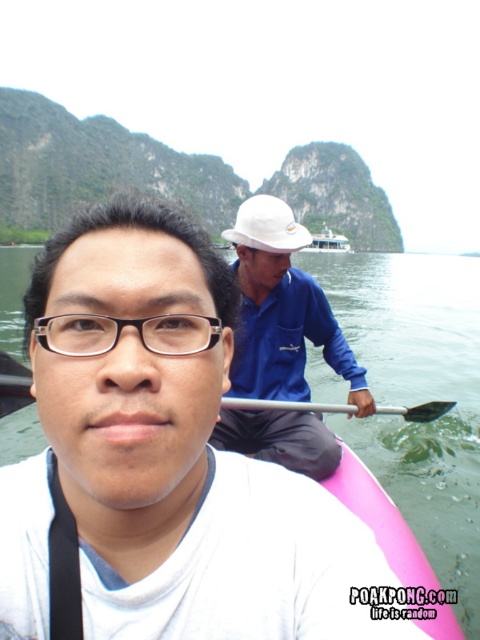
Does blue fabric shirt at center appear on the left side of silver metallic paddle at center?

Correct, you'll find blue fabric shirt at center to the left of silver metallic paddle at center.

Who is more distant from viewer, (252, 218) or (381, 412)?

The point (252, 218) is behind.

Locate an element on the screen. blue fabric shirt at center is located at coordinates (282, 310).

Does matte white helmet at upper center appear over silver metallic paddle at center?

Correct, matte white helmet at upper center is located above silver metallic paddle at center.

Does matte white helmet at upper center have a greater height compared to silver metallic paddle at center?

Yes, matte white helmet at upper center is taller than silver metallic paddle at center.

Where is `matte white helmet at upper center`? Image resolution: width=480 pixels, height=640 pixels. matte white helmet at upper center is located at coordinates (164, 464).

Can you confirm if matte white helmet at upper center is thinner than blue fabric shirt at center?

Incorrect, matte white helmet at upper center's width is not less than blue fabric shirt at center's.

Is point (414, 573) farther from viewer compared to point (248, 340)?

No, (414, 573) is in front of (248, 340).

Where is `matte white helmet at upper center`? Image resolution: width=480 pixels, height=640 pixels. matte white helmet at upper center is located at coordinates (164, 464).